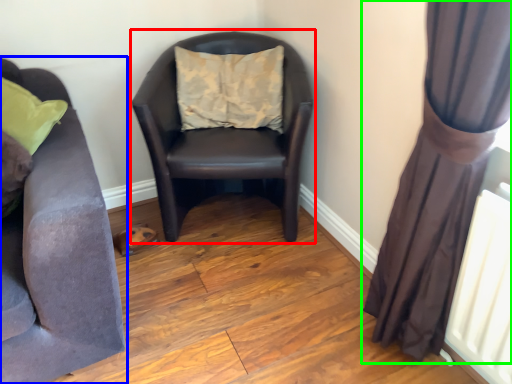
Question: Considering the real-world distances, which object is farthest from rocking chair (highlighted by a red box)? studio couch (highlighted by a blue box) or curtain (highlighted by a green box)?

Choices:
 (A) studio couch
 (B) curtain

Answer: (B)